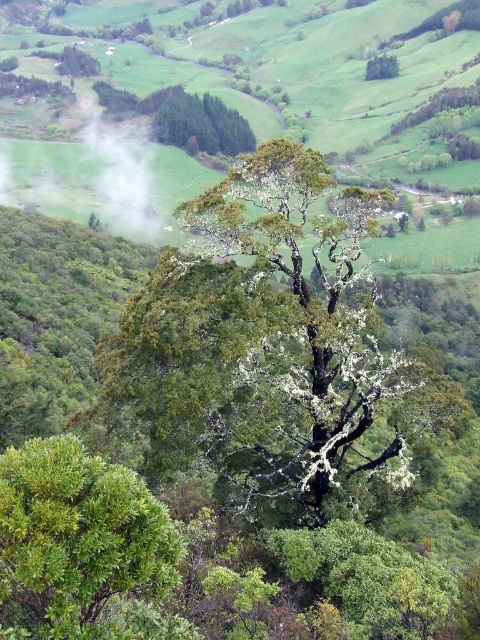
Question: Which object appears closest to the camera in this image?

Choices:
 (A) green leafy tree at upper center
 (B) green lichen-covered tree at center

Answer: (B)

Question: In this image, where is green lichen-covered tree at center located relative to green lichen-covered tree at upper center?

Choices:
 (A) right
 (B) left

Answer: (B)

Question: Estimate the real-world distances between objects in this image. Which object is closer to the green leafy bush at lower left?

Choices:
 (A) green leafy tree at upper center
 (B) green lichen-covered tree at center

Answer: (B)

Question: Is green lichen-covered tree at center further to the viewer compared to green leafy tree at upper center?

Choices:
 (A) yes
 (B) no

Answer: (B)

Question: Does green lichen-covered tree at center have a greater width compared to green lichen-covered tree at upper center?

Choices:
 (A) yes
 (B) no

Answer: (B)

Question: Which of the following is the closest to the observer?

Choices:
 (A) (164, 564)
 (B) (165, 120)
 (C) (367, 72)

Answer: (A)